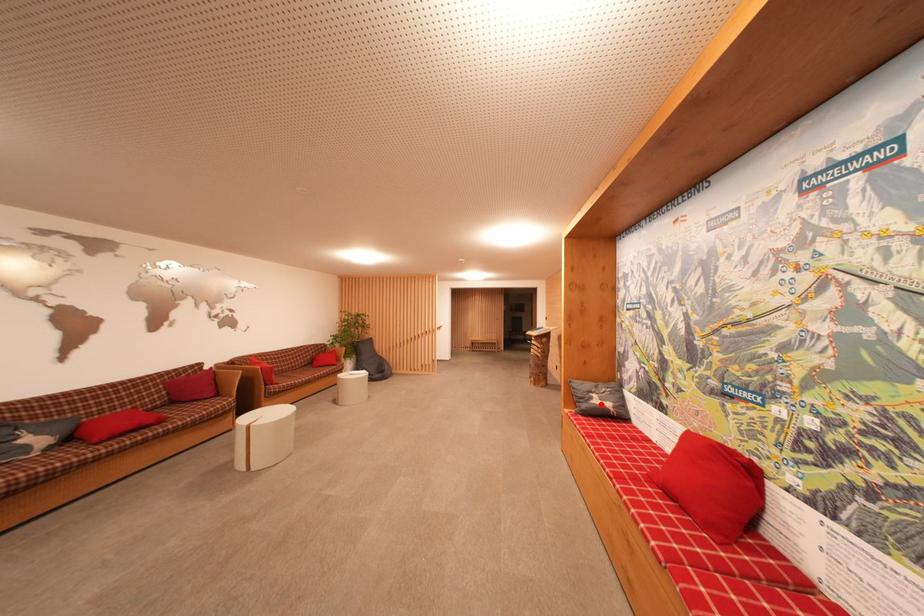
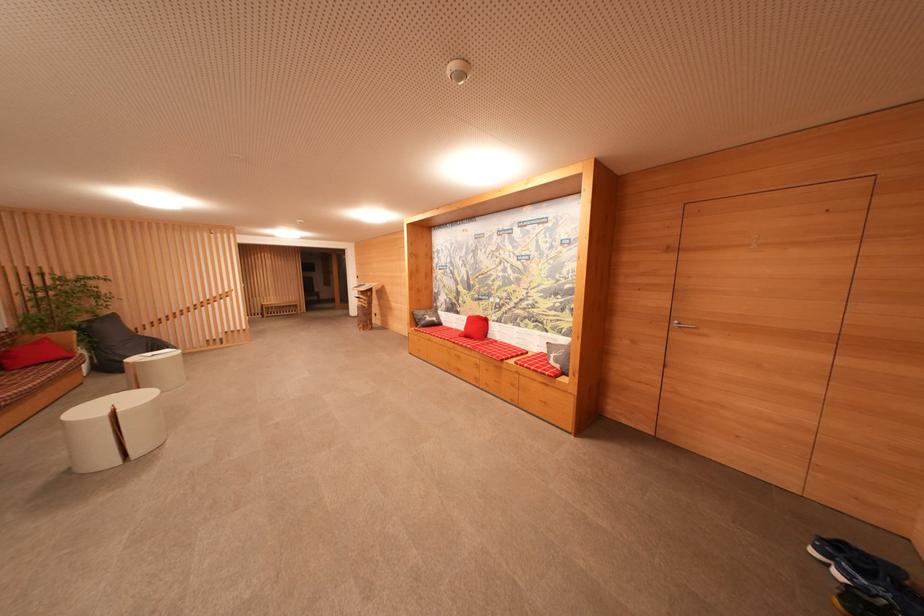
The point at the highlighted location is marked in the first image. Where is the corresponding point in the second image?

(432, 322)